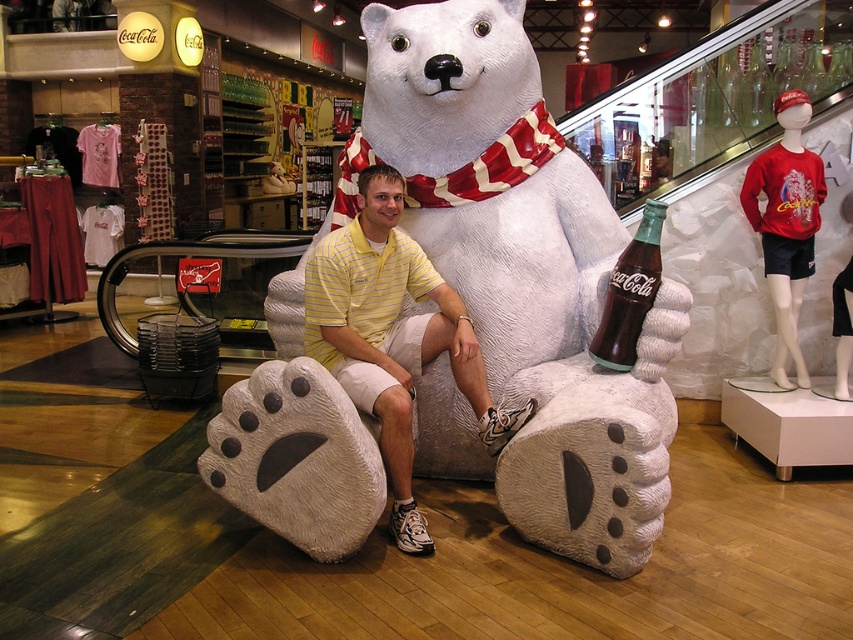
Question: Is yellow striped shirt at center to the left of dark brown glass bottle at center from the viewer's perspective?

Choices:
 (A) no
 (B) yes

Answer: (B)

Question: Which object appears farthest from the camera in this image?

Choices:
 (A) yellow striped shirt at center
 (B) white plush bear at center

Answer: (A)

Question: Is white plush bear at center further to camera compared to yellow striped shirt at center?

Choices:
 (A) yes
 (B) no

Answer: (B)

Question: Is white plush bear at center smaller than dark brown glass bottle at center?

Choices:
 (A) yes
 (B) no

Answer: (B)

Question: Which object is positioned farthest from the yellow striped shirt at center?

Choices:
 (A) dark brown glass bottle at center
 (B) white plush bear at center

Answer: (A)

Question: Estimate the real-world distances between objects in this image. Which object is farther from the dark brown glass bottle at center?

Choices:
 (A) yellow striped shirt at center
 (B) white plush bear at center

Answer: (A)